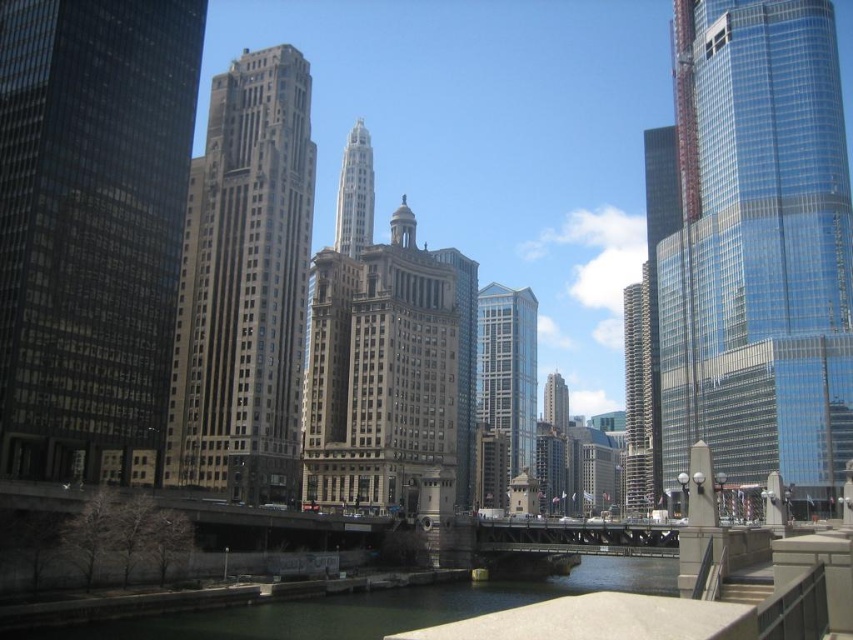
Is the position of gold textured building at center more distant than that of gray stone tower at center?

No, gold textured building at center is closer to the viewer.

Does gold textured building at center lie in front of gray stone tower at center?

Yes, it is in front of gray stone tower at center.

The width and height of the screenshot is (853, 640). In order to click on gold textured building at center in this screenshot , I will do `click(244, 285)`.

Locate an element on the screen. gold textured building at center is located at coordinates (244, 285).

Can you confirm if glassy reflective skyscraper at center is positioned below glassy reflective skyscraper at right?

Actually, glassy reflective skyscraper at center is above glassy reflective skyscraper at right.

Is the position of glassy reflective skyscraper at center less distant than that of glassy reflective skyscraper at right?

That is True.

Is point (490, 388) closer to camera compared to point (634, 454)?

Yes, it is in front of point (634, 454).

You are a GUI agent. You are given a task and a screenshot of the screen. Output one action in this format:
    pyautogui.click(x=<x>, y=<y>)
    Task: Click on the glassy reflective skyscraper at center
    The height and width of the screenshot is (640, 853).
    Given the screenshot: What is the action you would take?
    pos(508,369)

Can you confirm if beige stone building at center is positioned above gray stone tower at center?

Incorrect, beige stone building at center is not positioned above gray stone tower at center.

Between point (413, 323) and point (354, 189), which one is positioned behind?

The point (354, 189) is more distant.

The image size is (853, 640). I want to click on beige stone building at center, so click(381, 376).

The image size is (853, 640). In order to click on beige stone building at center in this screenshot , I will do `click(381, 376)`.